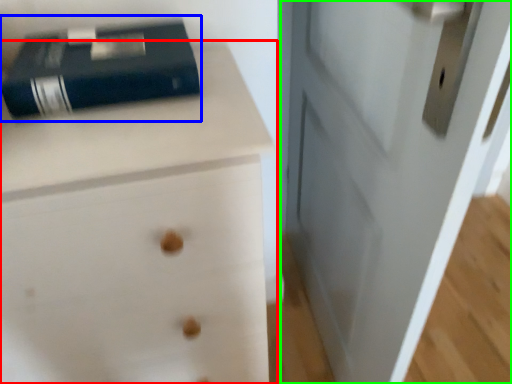
Question: Which is nearer to the chest of drawers (highlighted by a red box)? paperback book (highlighted by a blue box) or door (highlighted by a green box).

Choices:
 (A) paperback book
 (B) door

Answer: (A)